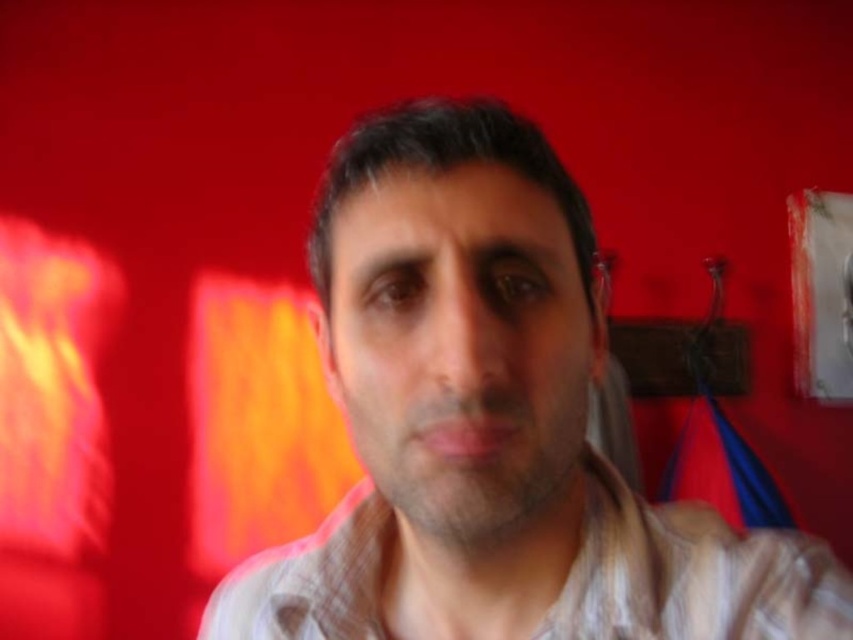
Question: Is the position of light beige striped shirt at center more distant than that of brown plaid shirt at center?

Choices:
 (A) yes
 (B) no

Answer: (B)

Question: Is light beige striped shirt at center further to camera compared to brown plaid shirt at center?

Choices:
 (A) no
 (B) yes

Answer: (A)

Question: Can you confirm if light beige striped shirt at center is positioned above brown plaid shirt at center?

Choices:
 (A) yes
 (B) no

Answer: (A)

Question: Which of the following is the farthest from the observer?

Choices:
 (A) light beige striped shirt at center
 (B) brown plaid shirt at center

Answer: (B)

Question: Which of the following is the closest to the observer?

Choices:
 (A) brown plaid shirt at center
 (B) light beige striped shirt at center

Answer: (B)

Question: Which point appears closest to the camera in this image?

Choices:
 (A) (281, 609)
 (B) (331, 276)

Answer: (B)